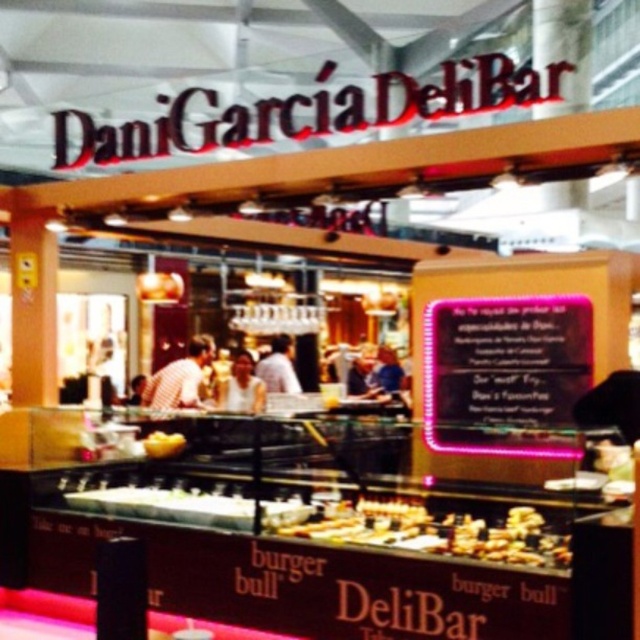
You are standing in front of the food stall and want to grab the golden brown bread at center. Considering your arm length is 2.5 feet, can you reach it without moving closer?

The golden brown bread at center is 13.86 feet away from you, which is much farther than your arm length of 2.5 feet. You cannot reach it without moving closer.

You are a customer at the Dani Garcia Deli Bar food stall. You see a white shirt at center. Where is the white shirt located in the stall?

The white shirt at center is located at the coordinates point [278,368].

You are a customer at the food stall and want to order the sandwich with the golden brown bread at center. The cashier asks you to point out which bread you want. Which direction should you indicate from the yellow matte bread at lower left?

The golden brown bread at center is to the right of the yellow matte bread at lower left, so you should indicate the direction to the right.